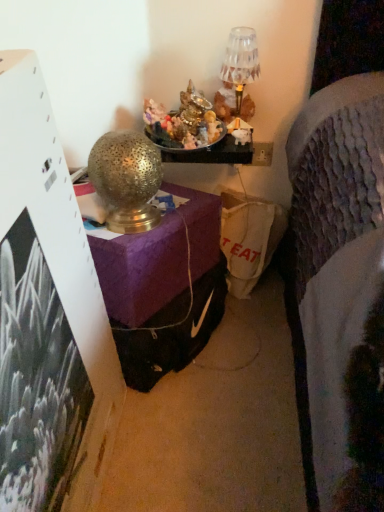
I want to click on gold textured lamp at upper center, which is the 2th table lamp from top to bottom, so click(127, 180).

This screenshot has height=512, width=384. Describe the element at coordinates (127, 180) in the screenshot. I see `gold textured lamp at upper center, placed as the 2th table lamp when sorted from right to left` at that location.

What is the approximate height of crystal glass table lamp at upper center, which ranks as the 1th table lamp in back-to-front order?

14.74 centimeters.

Measure the distance between crystal glass table lamp at upper center, which ranks as the 1th table lamp in back-to-front order, and camera.

crystal glass table lamp at upper center, which ranks as the 1th table lamp in back-to-front order, and camera are 1.16 meters apart.

This screenshot has width=384, height=512. What do you see at coordinates (241, 61) in the screenshot? I see `crystal glass table lamp at upper center, which ranks as the 1th table lamp in back-to-front order` at bounding box center [241, 61].

Where is `crystal glass table lamp at upper center, placed as the second table lamp when sorted from front to back`? The image size is (384, 512). crystal glass table lamp at upper center, placed as the second table lamp when sorted from front to back is located at coordinates (241, 61).

Where is `gold textured lamp at upper center, which is the second table lamp from back to front`? The height and width of the screenshot is (512, 384). gold textured lamp at upper center, which is the second table lamp from back to front is located at coordinates (127, 180).

In the scene shown: Between crystal glass table lamp at upper center, positioned as the 2th table lamp in left-to-right order, and gold textured lamp at upper center, placed as the 2th table lamp when sorted from right to left, which one appears on the right side from the viewer's perspective?

From the viewer's perspective, crystal glass table lamp at upper center, positioned as the 2th table lamp in left-to-right order, appears more on the right side.

Who is more distant, crystal glass table lamp at upper center, placed as the second table lamp when sorted from front to back, or gold textured lamp at upper center, placed as the 2th table lamp when sorted from right to left?

crystal glass table lamp at upper center, placed as the second table lamp when sorted from front to back, is further away from the camera.

Between point (241, 35) and point (100, 194), which one is positioned behind?

The point (241, 35) is more distant.

From the image's perspective, which one is positioned higher, crystal glass table lamp at upper center, which ranks as the 1th table lamp in top-to-bottom order, or gold textured lamp at upper center, which is the second table lamp from back to front?

From the image's view, crystal glass table lamp at upper center, which ranks as the 1th table lamp in top-to-bottom order, is above.

From a real-world perspective, is crystal glass table lamp at upper center, positioned as the 2th table lamp in left-to-right order, physically located above or below gold textured lamp at upper center, the 1th table lamp when ordered from bottom to top?

Clearly, from a real-world perspective, crystal glass table lamp at upper center, positioned as the 2th table lamp in left-to-right order, is above gold textured lamp at upper center, the 1th table lamp when ordered from bottom to top.

Considering the sizes of objects crystal glass table lamp at upper center, placed as the second table lamp when sorted from front to back, and gold textured lamp at upper center, the 1th table lamp when ordered from bottom to top, in the image provided, who is wider, crystal glass table lamp at upper center, placed as the second table lamp when sorted from front to back, or gold textured lamp at upper center, the 1th table lamp when ordered from bottom to top,?

Wider between the two is gold textured lamp at upper center, the 1th table lamp when ordered from bottom to top.

Considering the sizes of crystal glass table lamp at upper center, placed as the second table lamp when sorted from front to back, and gold textured lamp at upper center, which is the second table lamp from back to front, in the image, is crystal glass table lamp at upper center, placed as the second table lamp when sorted from front to back, taller or shorter than gold textured lamp at upper center, which is the second table lamp from back to front,?

Considering their sizes, crystal glass table lamp at upper center, placed as the second table lamp when sorted from front to back, has less height than gold textured lamp at upper center, which is the second table lamp from back to front.

In terms of size, does crystal glass table lamp at upper center, acting as the 2th table lamp starting from the bottom, appear bigger or smaller than gold textured lamp at upper center, the first table lamp when ordered from left to right?

Clearly, crystal glass table lamp at upper center, acting as the 2th table lamp starting from the bottom, is smaller in size than gold textured lamp at upper center, the first table lamp when ordered from left to right.

Is gold textured lamp at upper center, which is the 2th table lamp from top to bottom, surrounded by crystal glass table lamp at upper center, placed as the second table lamp when sorted from front to back?

No, gold textured lamp at upper center, which is the 2th table lamp from top to bottom, is not a part of crystal glass table lamp at upper center, placed as the second table lamp when sorted from front to back.

Is crystal glass table lamp at upper center, placed as the second table lamp when sorted from front to back, positioned far away from gold textured lamp at upper center, which is the 2th table lamp from top to bottom?

crystal glass table lamp at upper center, placed as the second table lamp when sorted from front to back, is actually quite close to gold textured lamp at upper center, which is the 2th table lamp from top to bottom.

Is crystal glass table lamp at upper center, acting as the 2th table lamp starting from the bottom, oriented towards gold textured lamp at upper center, the first table lamp when ordered from left to right?

No, crystal glass table lamp at upper center, acting as the 2th table lamp starting from the bottom, does not turn towards gold textured lamp at upper center, the first table lamp when ordered from left to right.

What's the angular difference between crystal glass table lamp at upper center, acting as the 2th table lamp starting from the bottom, and gold textured lamp at upper center, which ranks as the 1th table lamp in front-to-back order,'s facing directions?

They differ by 0.491 degrees in their facing directions.

This screenshot has width=384, height=512. Identify the location of table lamp that is on the right side of gold textured lamp at upper center, which is the second table lamp from back to front. (241, 61).

Is gold textured lamp at upper center, the first table lamp when ordered from left to right, to the left or to the right of crystal glass table lamp at upper center, acting as the 2th table lamp starting from the bottom, in the image?

Clearly, gold textured lamp at upper center, the first table lamp when ordered from left to right, is on the left of crystal glass table lamp at upper center, acting as the 2th table lamp starting from the bottom, in the image.

Which is in front, gold textured lamp at upper center, the first table lamp when ordered from left to right, or crystal glass table lamp at upper center, which ranks as the 1th table lamp in back-to-front order?

gold textured lamp at upper center, the first table lamp when ordered from left to right, is closer to the camera.

Is point (102, 178) farther from viewer compared to point (242, 87)?

No.

From the image's perspective, is gold textured lamp at upper center, placed as the 2th table lamp when sorted from right to left, above or below crystal glass table lamp at upper center, positioned as the 2th table lamp in left-to-right order?

gold textured lamp at upper center, placed as the 2th table lamp when sorted from right to left, is below crystal glass table lamp at upper center, positioned as the 2th table lamp in left-to-right order.

From a real-world perspective, is gold textured lamp at upper center, which is the second table lamp from back to front, positioned under crystal glass table lamp at upper center, acting as the 2th table lamp starting from the bottom, based on gravity?

Correct, in the physical world, gold textured lamp at upper center, which is the second table lamp from back to front, is lower than crystal glass table lamp at upper center, acting as the 2th table lamp starting from the bottom.

Does gold textured lamp at upper center, the first table lamp when ordered from left to right, have a greater width compared to crystal glass table lamp at upper center, positioned as the 2th table lamp in left-to-right order?

Yes, gold textured lamp at upper center, the first table lamp when ordered from left to right, is wider than crystal glass table lamp at upper center, positioned as the 2th table lamp in left-to-right order.

Considering the sizes of objects gold textured lamp at upper center, which ranks as the 1th table lamp in front-to-back order, and crystal glass table lamp at upper center, positioned as the 2th table lamp in left-to-right order, in the image provided, who is taller, gold textured lamp at upper center, which ranks as the 1th table lamp in front-to-back order, or crystal glass table lamp at upper center, positioned as the 2th table lamp in left-to-right order,?

gold textured lamp at upper center, which ranks as the 1th table lamp in front-to-back order.

Looking at the image, does gold textured lamp at upper center, the first table lamp when ordered from left to right, seem bigger or smaller compared to crystal glass table lamp at upper center, acting as the 2th table lamp starting from the bottom?

Considering their sizes, gold textured lamp at upper center, the first table lamp when ordered from left to right, takes up more space than crystal glass table lamp at upper center, acting as the 2th table lamp starting from the bottom.

In the scene shown: Choose the correct answer: Is gold textured lamp at upper center, which is the second table lamp from back to front, inside crystal glass table lamp at upper center, acting as the 2th table lamp starting from the bottom, or outside it?

gold textured lamp at upper center, which is the second table lamp from back to front, is spatially situated outside crystal glass table lamp at upper center, acting as the 2th table lamp starting from the bottom.

Is gold textured lamp at upper center, which ranks as the 1th table lamp in front-to-back order, next to crystal glass table lamp at upper center, positioned as the 2th table lamp in left-to-right order, and touching it?

They are not placed beside each other.

Does gold textured lamp at upper center, the 1th table lamp when ordered from bottom to top, turn towards crystal glass table lamp at upper center, which ranks as the 1th table lamp in top-to-bottom order?

No, gold textured lamp at upper center, the 1th table lamp when ordered from bottom to top, is not oriented towards crystal glass table lamp at upper center, which ranks as the 1th table lamp in top-to-bottom order.

How much distance is there between gold textured lamp at upper center, the first table lamp when ordered from left to right, and crystal glass table lamp at upper center, acting as the 2th table lamp starting from the bottom?

16.56 inches.

You are a GUI agent. You are given a task and a screenshot of the screen. Output one action in this format:
    pyautogui.click(x=<x>, y=<y>)
    Task: Click on the table lamp beneath the crystal glass table lamp at upper center, the first table lamp from the right (from a real-world perspective)
    
    Given the screenshot: What is the action you would take?
    pyautogui.click(x=127, y=180)

Image resolution: width=384 pixels, height=512 pixels. What are the coordinates of `table lamp on the left of the crystal glass table lamp at upper center, the first table lamp from the right` in the screenshot? It's located at pyautogui.click(x=127, y=180).

In the image, there is a gold textured lamp at upper center, placed as the 2th table lamp when sorted from right to left. Where is `table lamp above it (from the image's perspective)`? This screenshot has width=384, height=512. table lamp above it (from the image's perspective) is located at coordinates (241, 61).